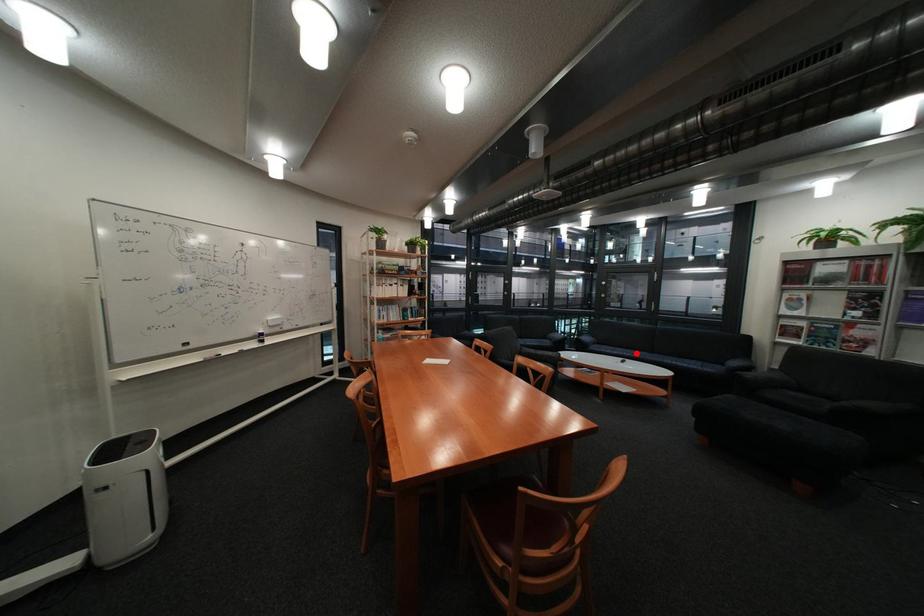
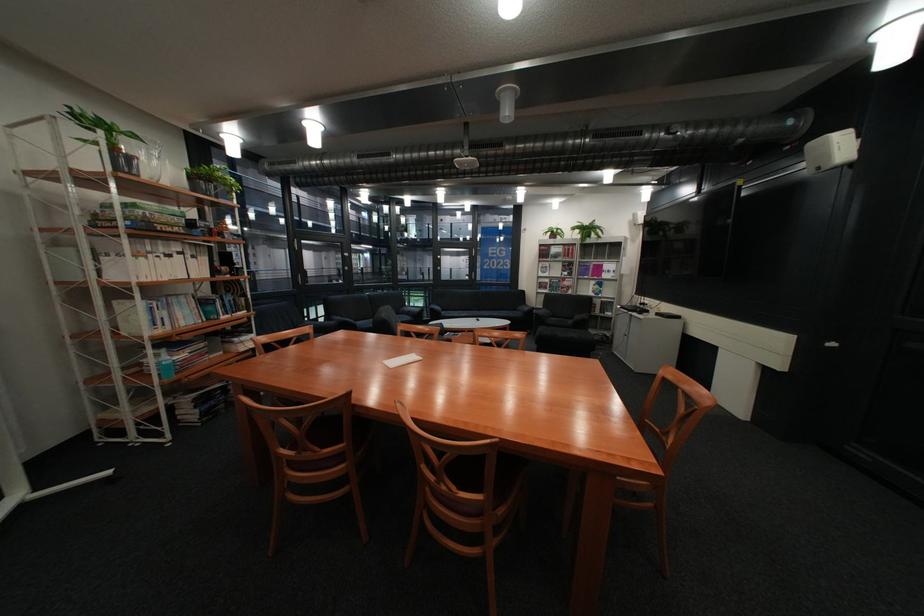
Where in the second image is the point corresponding to the highlighted location from the first image?

(481, 315)